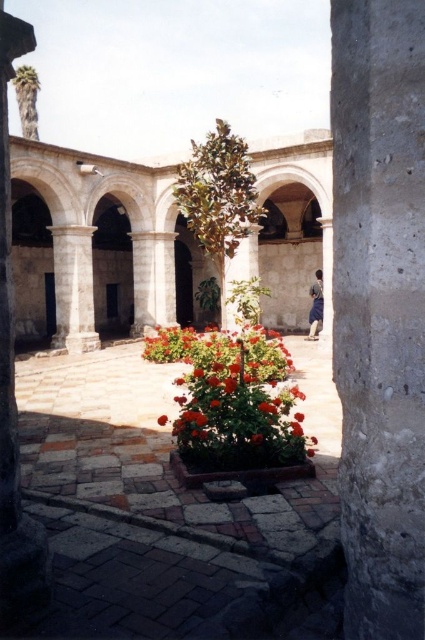
Does smooth stone pillar at left appear on the left side of brown fabric person at center?

Correct, you'll find smooth stone pillar at left to the left of brown fabric person at center.

Find the location of a particular element. The height and width of the screenshot is (640, 425). smooth stone pillar at left is located at coordinates (14, 387).

You are a GUI agent. You are given a task and a screenshot of the screen. Output one action in this format:
    pyautogui.click(x=<x>, y=<y>)
    Task: Click on the smooth stone pillar at left
    This screenshot has width=425, height=640.
    Given the screenshot: What is the action you would take?
    pyautogui.click(x=14, y=387)

Who is positioned more to the right, glossy ceramic flower bed at center or red matte flower at center?

glossy ceramic flower bed at center is more to the right.

Is glossy ceramic flower bed at center closer to camera compared to red matte flower at center?

No, it is not.

This screenshot has height=640, width=425. I want to click on glossy ceramic flower bed at center, so click(221, 349).

Which of these two, gray concrete pillar at center or glossy ceramic flower bed at center, stands shorter?

glossy ceramic flower bed at center

Who is lower down, gray concrete pillar at center or glossy ceramic flower bed at center?

glossy ceramic flower bed at center is lower down.

Who is more forward, (385,204) or (193,342)?

Point (385,204)

Locate an element on the screen. This screenshot has width=425, height=640. gray concrete pillar at center is located at coordinates (379, 308).